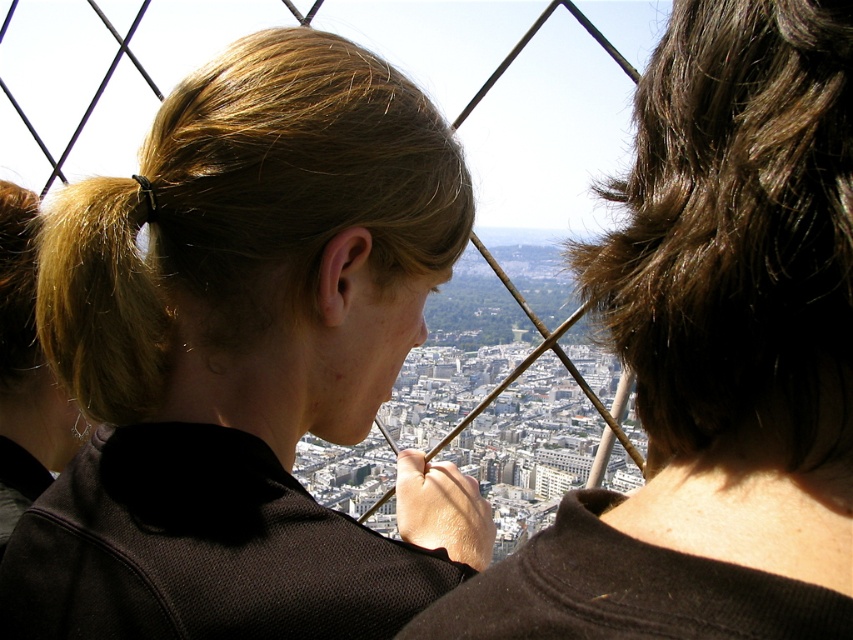
In the scene shown: Who is positioned more to the left, matte black hair at upper left or brown shiny hair at upper right?

matte black hair at upper left

Is matte black hair at upper left above brown shiny hair at upper right?

Incorrect, matte black hair at upper left is not positioned above brown shiny hair at upper right.

Between point (663, 259) and point (805, 93), which one is positioned in front?

Positioned in front is point (805, 93).

Where is `matte black hair at upper left`? The image size is (853, 640). matte black hair at upper left is located at coordinates (715, 353).

Can you confirm if blonde hair at center is positioned to the right of matte black hair at upper left?

Incorrect, blonde hair at center is not on the right side of matte black hair at upper left.

Where is `blonde hair at center`? The height and width of the screenshot is (640, 853). blonde hair at center is located at coordinates (247, 358).

Is point (148, 180) positioned in front of point (51, 364)?

That is True.

Between blonde hair at center and blonde hair at left, which one appears on the left side from the viewer's perspective?

Positioned to the left is blonde hair at left.

Is point (199, 240) farther from viewer compared to point (122, 276)?

Yes, it is behind point (122, 276).

Where is `blonde hair at center`? blonde hair at center is located at coordinates (247, 358).